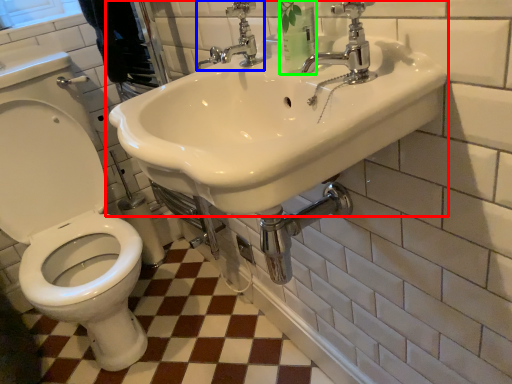
Question: Considering the real-world distances, which object is closest to sink (highlighted by a red box)? tap (highlighted by a blue box) or toiletry (highlighted by a green box).

Choices:
 (A) tap
 (B) toiletry

Answer: (B)